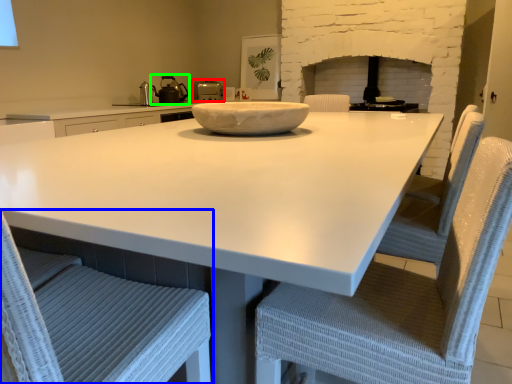
Question: Which object is positioned closest to kitchen appliance (highlighted by a red box)? Select from chair (highlighted by a blue box) and tea pot (highlighted by a green box).

Choices:
 (A) chair
 (B) tea pot

Answer: (B)